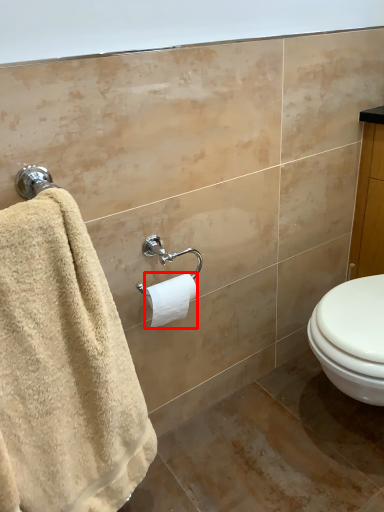
Question: In this image, where is toilet paper (annotated by the red box) located relative to towel?

Choices:
 (A) left
 (B) right

Answer: (B)